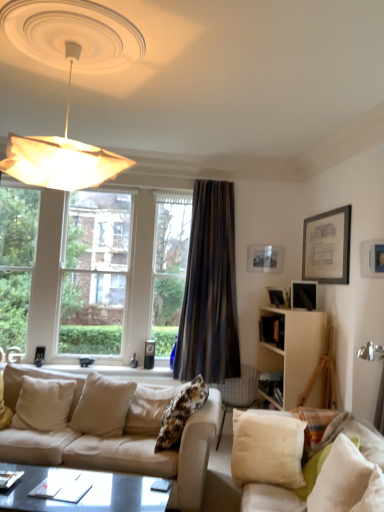
Question: Is white cotton pillow at lower right, the fourth pillow when ordered from left to right, at the right side of matte black picture frame at upper right, placed as the 3th picture frame when sorted from front to back?

Choices:
 (A) no
 (B) yes

Answer: (A)

Question: From a real-world perspective, is white cotton pillow at lower right, which ranks as the 2th pillow in right-to-left order, under matte black picture frame at upper right, arranged as the 2th picture frame when viewed from the back?

Choices:
 (A) yes
 (B) no

Answer: (A)

Question: From a real-world perspective, is white cotton pillow at lower right, which ranks as the 2th pillow in right-to-left order, physically above matte black picture frame at upper right, which is the second picture frame from left to right?

Choices:
 (A) no
 (B) yes

Answer: (A)

Question: Is white cotton pillow at lower right, which ranks as the 2th pillow in right-to-left order, oriented towards matte black picture frame at upper right, arranged as the 2th picture frame when viewed from the back?

Choices:
 (A) no
 (B) yes

Answer: (A)

Question: Is white cotton pillow at lower right, which ranks as the 2th pillow in right-to-left order, to the left of matte black picture frame at upper right, placed as the 3th picture frame when sorted from front to back, from the viewer's perspective?

Choices:
 (A) yes
 (B) no

Answer: (A)

Question: Would you say white cotton pillow at lower right, the fourth pillow when ordered from left to right, is a long distance from matte black picture frame at upper right, which is the second picture frame from left to right?

Choices:
 (A) yes
 (B) no

Answer: (A)

Question: Can white fabric lampshade at upper left be found inside white soft pillow at lower right, the 5th pillow when ordered from left to right?

Choices:
 (A) no
 (B) yes

Answer: (A)

Question: Can you confirm if white soft pillow at lower right, the 5th pillow when ordered from left to right, is wider than white fabric lampshade at upper left?

Choices:
 (A) no
 (B) yes

Answer: (A)

Question: From the image's perspective, is white soft pillow at lower right, the 5th pillow when ordered from left to right, above white fabric lampshade at upper left?

Choices:
 (A) no
 (B) yes

Answer: (A)

Question: Is white soft pillow at lower right, positioned as the 1th pillow in right-to-left order, at the right side of white fabric lampshade at upper left?

Choices:
 (A) yes
 (B) no

Answer: (A)

Question: From a real-world perspective, is white soft pillow at lower right, positioned as the 1th pillow in right-to-left order, beneath white fabric lampshade at upper left?

Choices:
 (A) yes
 (B) no

Answer: (A)

Question: Does white soft pillow at lower right, positioned as the 1th pillow in right-to-left order, touch white fabric lampshade at upper left?

Choices:
 (A) yes
 (B) no

Answer: (B)

Question: From the image's perspective, would you say white fabric lampshade at upper left is positioned over beige fabric couch at lower left, positioned as the second studio couch in right-to-left order?

Choices:
 (A) yes
 (B) no

Answer: (A)